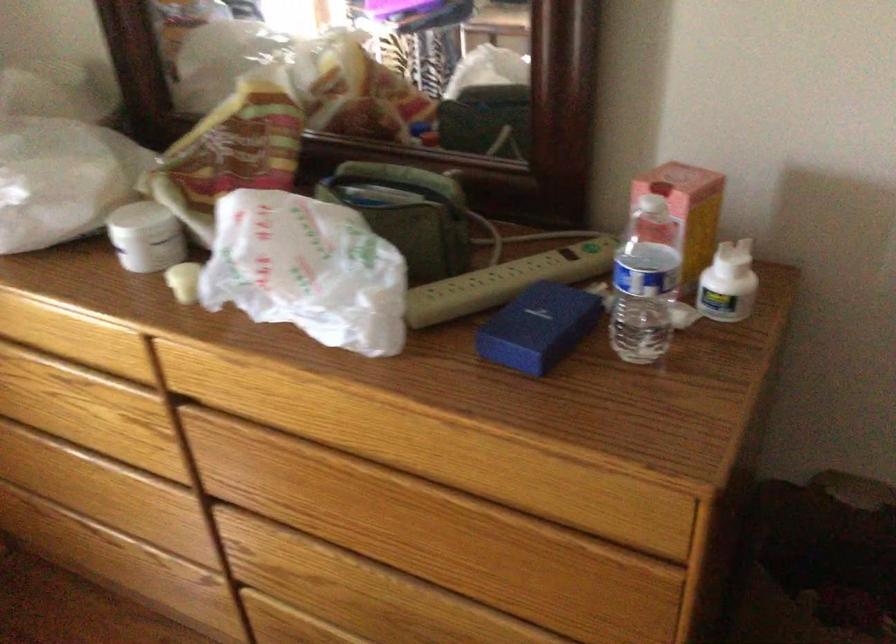
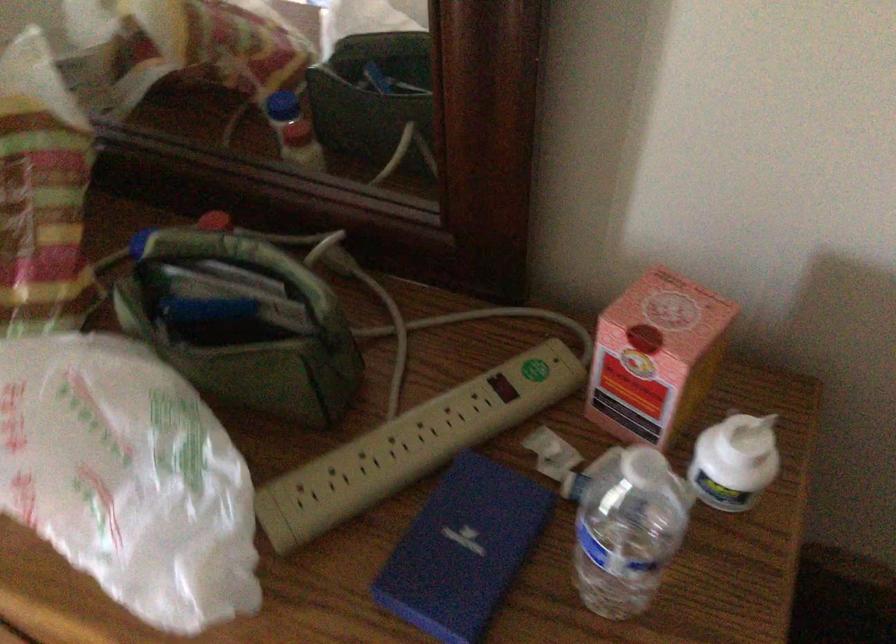
Find the pixel in the second image that matches point 392,213 in the first image.

(239, 322)